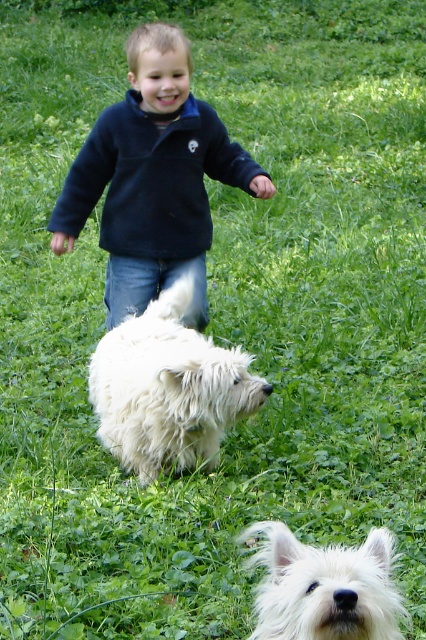
Between point (144, 195) and point (333, 614), which one is positioned behind?

The point (144, 195) is behind.

Does point (141, 192) come farther from viewer compared to point (313, 573)?

Yes, point (141, 192) is behind point (313, 573).

The image size is (426, 640). What do you see at coordinates (152, 179) in the screenshot?
I see `dark blue fleece jacket at center` at bounding box center [152, 179].

The height and width of the screenshot is (640, 426). What are the coordinates of `dark blue fleece jacket at center` in the screenshot? It's located at (152, 179).

Is white fluffy dog at center in front of white fluffy dog at lower center?

No, white fluffy dog at center is behind white fluffy dog at lower center.

Can you confirm if white fluffy dog at center is shorter than white fluffy dog at lower center?

In fact, white fluffy dog at center may be taller than white fluffy dog at lower center.

Who is more forward, (155, 476) or (284, 560)?

Point (284, 560) is in front.

Where is `white fluffy dog at center`? white fluffy dog at center is located at coordinates (167, 388).

Is point (72, 195) farther from camera compared to point (146, 451)?

Yes, it is.

Does dark blue fleece jacket at center lie behind white fluffy dog at center?

Yes, dark blue fleece jacket at center is behind white fluffy dog at center.

Between point (83, 198) and point (206, 397), which one is positioned in front?

Point (206, 397) is in front.

Find the location of a particular element. dark blue fleece jacket at center is located at coordinates (152, 179).